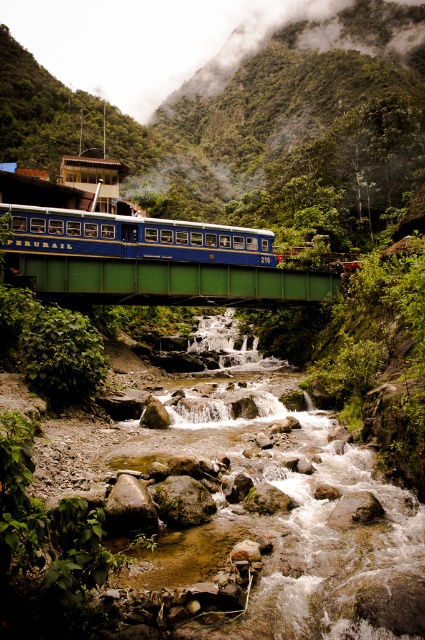
You are a photographer standing on the green painted metal bridge at center and want to take a photo of the blue polished wood passenger train at center. Since the bridge is your foreground, will the train appear smaller or larger in the photo compared to its actual size?

The green painted metal bridge at center is closer to the viewer than the blue polished wood passenger train at center, so the train will appear smaller in the photo compared to its actual size.

You are a passenger on the blue polished wood passenger train at center. You look out the window and see the green painted metal bridge at center below you. Based on the scene, can you determine if the bridge is taller or shorter than the train?

The green painted metal bridge at center has a lesser height compared to the blue polished wood passenger train at center, so the bridge is shorter than the train.

You are standing at point (25, 250) and want to walk to the train on the bridge. Which direction should you move relative to point (206, 301)?

You should move towards point (206, 301) because it is behind point (25, 250), so moving towards it would lead you in the direction of the train on the bridge.